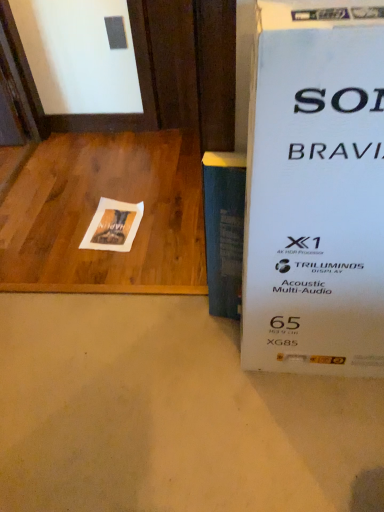
Locate an element on the screen. The height and width of the screenshot is (512, 384). empty space that is ontop of white paper at center (from a real-world perspective) is located at coordinates (119, 221).